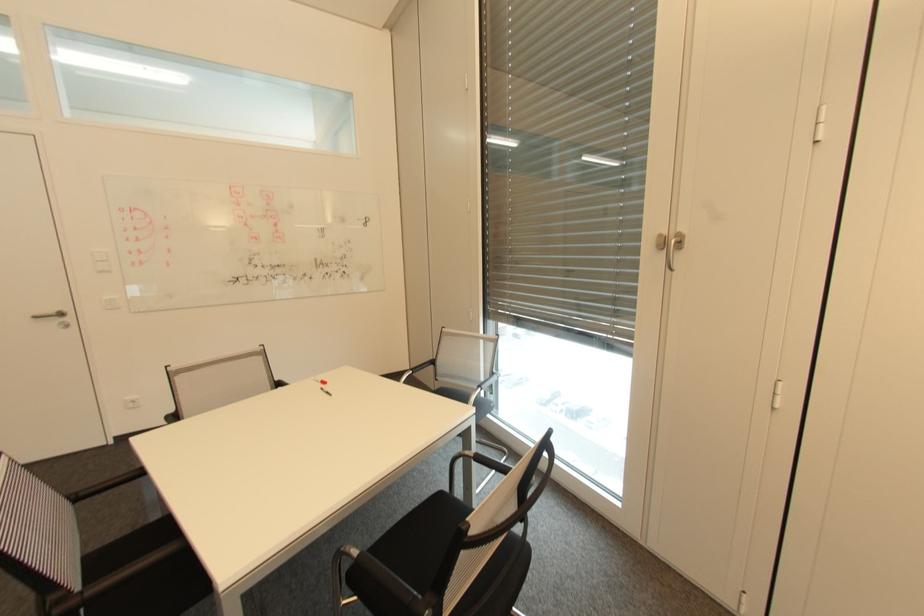
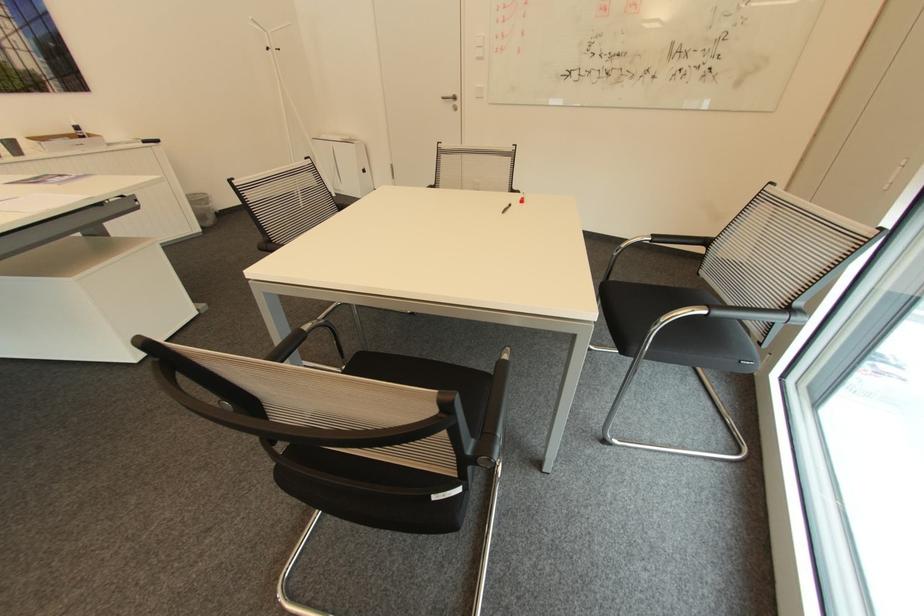
In the second image, find the point that corresponds to pixel 436 362 in the first image.

(710, 241)